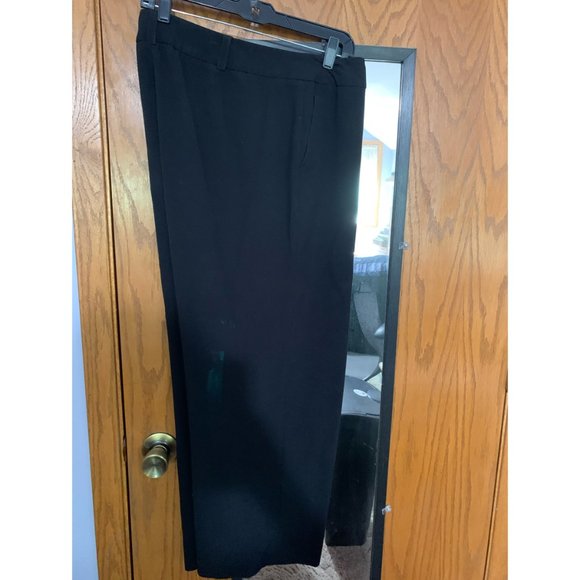
I want to click on black trim, so click(403, 184).